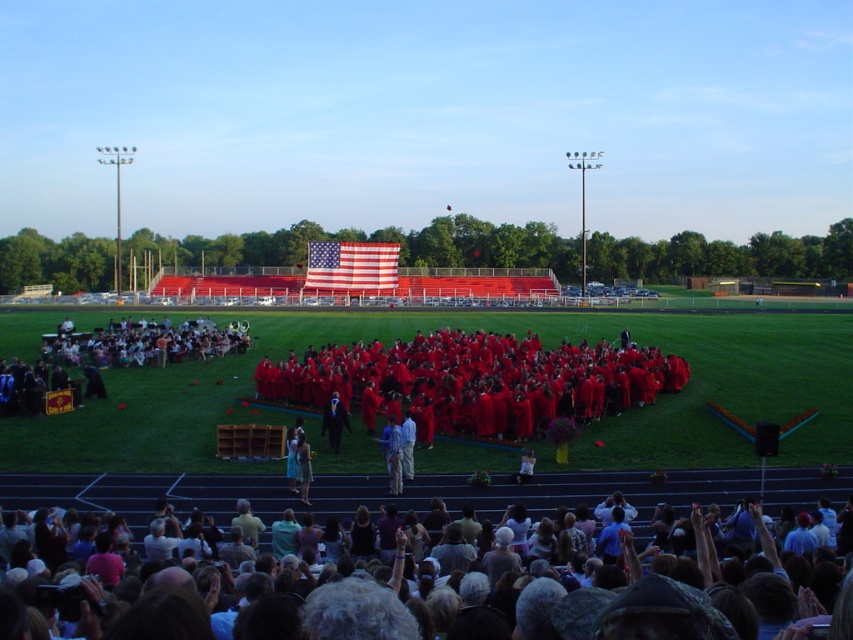
Question: From the image, what is the correct spatial relationship of red matte graduation gowns at center in relation to matte red graduation gowns at lower center?

Choices:
 (A) below
 (B) above

Answer: (B)

Question: Which of the following is the farthest from the observer?

Choices:
 (A) blue fabric shirt at center
 (B) red matte graduation gowns at center
 (C) matte red graduation gowns at lower center
 (D) dark blue suit at center

Answer: (D)

Question: Is red matte graduation gowns at center to the left of blue fabric shirt at center from the viewer's perspective?

Choices:
 (A) no
 (B) yes

Answer: (A)

Question: Does red matte graduation gowns at center come in front of blue fabric shirt at center?

Choices:
 (A) no
 (B) yes

Answer: (A)

Question: Which object is the closest to the dark blue suit at center?

Choices:
 (A) matte red graduation gowns at lower center
 (B) blue fabric shirt at center

Answer: (B)

Question: Which point is farther to the camera?

Choices:
 (A) matte red graduation gowns at lower center
 (B) red matte graduation gowns at center
 (C) dark blue suit at center

Answer: (C)